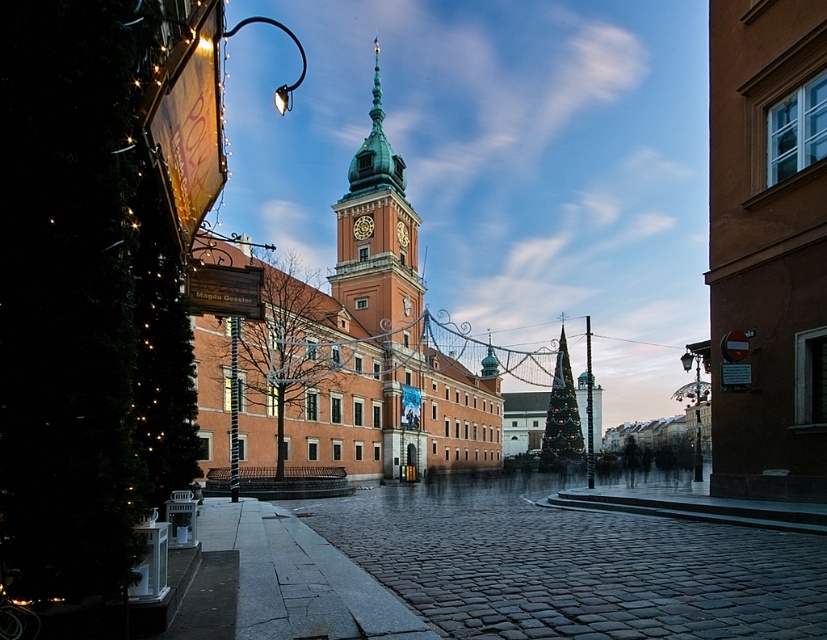
Question: Which point is farther to the camera?

Choices:
 (A) gold metallic clock at center
 (B) brick tower at center
 (C) green copper clock tower at center

Answer: (A)

Question: Can you confirm if brick tower at center is thinner than gold metallic clock at center?

Choices:
 (A) no
 (B) yes

Answer: (A)

Question: Which point is farther to the camera?

Choices:
 (A) gold metallic clock at center
 (B) green copper clock tower at center

Answer: (A)

Question: Considering the relative positions of green glittering christmas tree at center and gold metallic clock at center in the image provided, where is green glittering christmas tree at center located with respect to gold metallic clock at center?

Choices:
 (A) left
 (B) right

Answer: (B)

Question: Can you confirm if brick tower at center is smaller than gold metallic clock at center?

Choices:
 (A) yes
 (B) no

Answer: (B)

Question: Which point is closer to the camera?

Choices:
 (A) (371, 179)
 (B) (390, 328)
 (C) (563, 333)

Answer: (B)